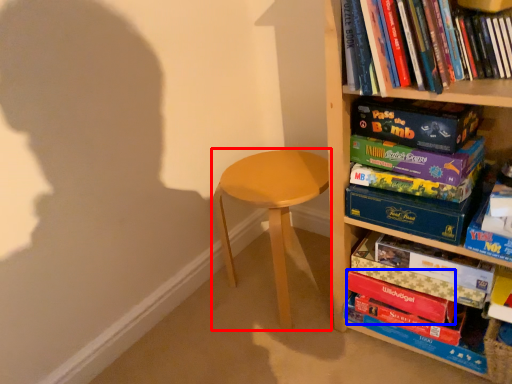
Question: Which object is closer to the camera taking this photo, stool (highlighted by a red box) or paperback book (highlighted by a blue box)?

Choices:
 (A) stool
 (B) paperback book

Answer: (B)